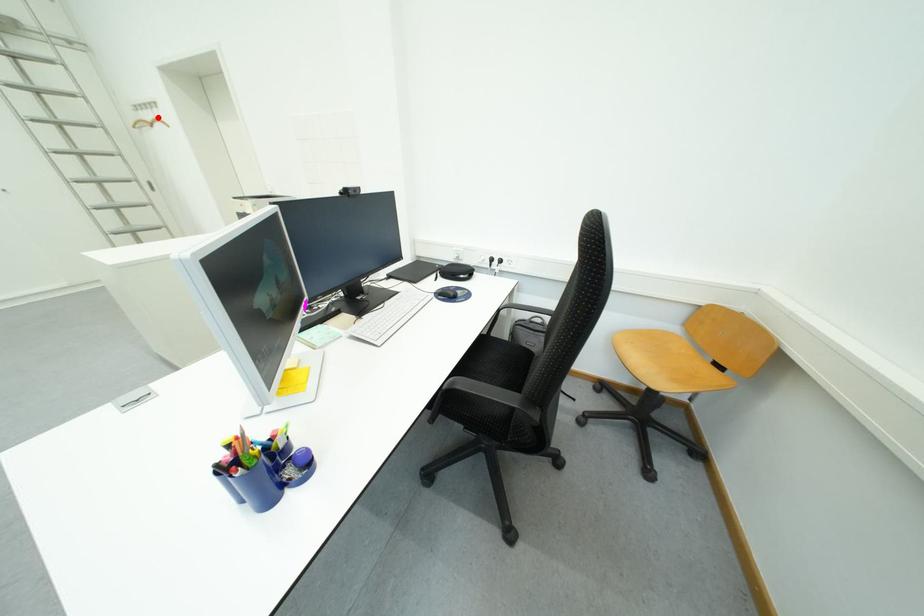
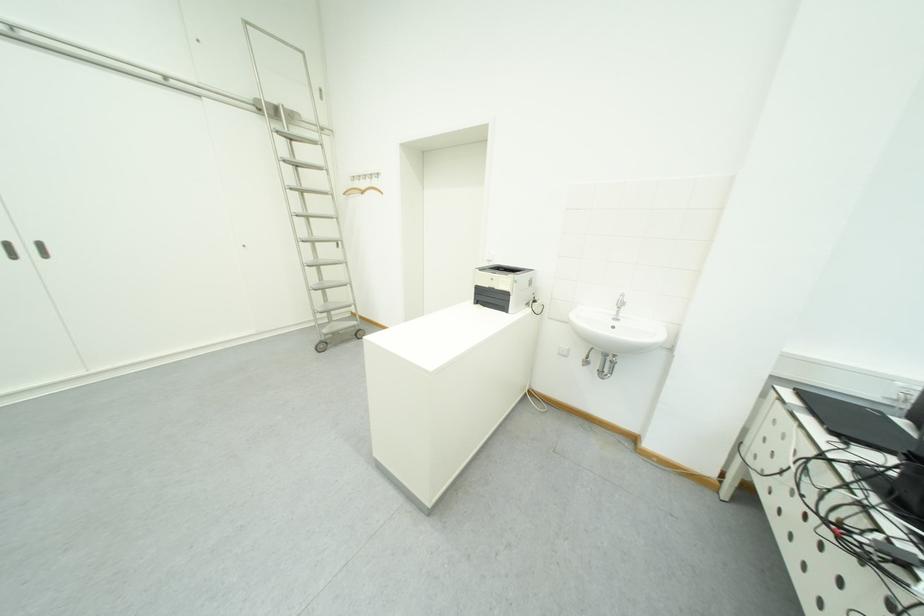
Question: I am providing you with two images of the same scene from different viewpoints. A red point is marked on the first image. At the location where the point appears in image 1, is it still visible in image 2?

Choices:
 (A) Yes
 (B) No

Answer: (A)